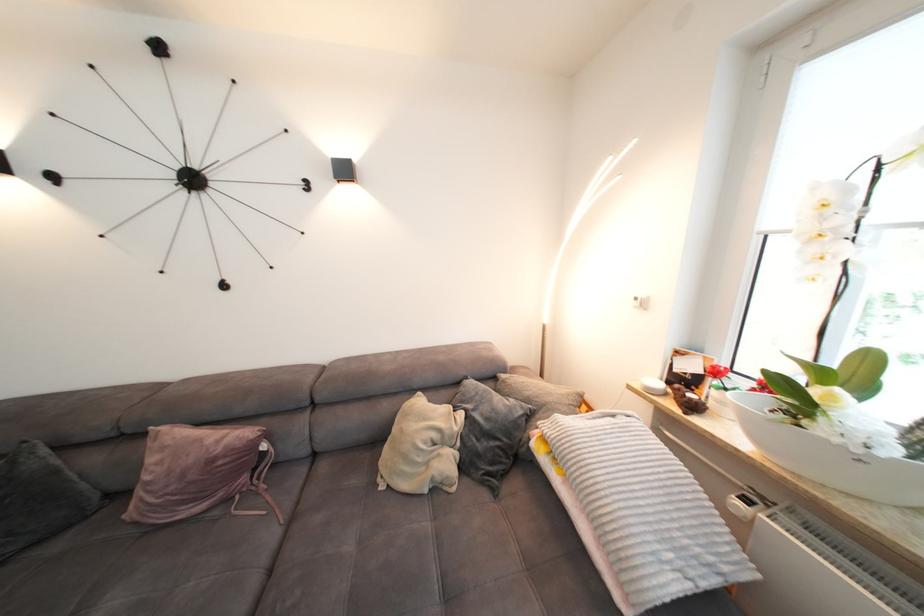
I want to click on radiator thermostat knob, so click(744, 505).